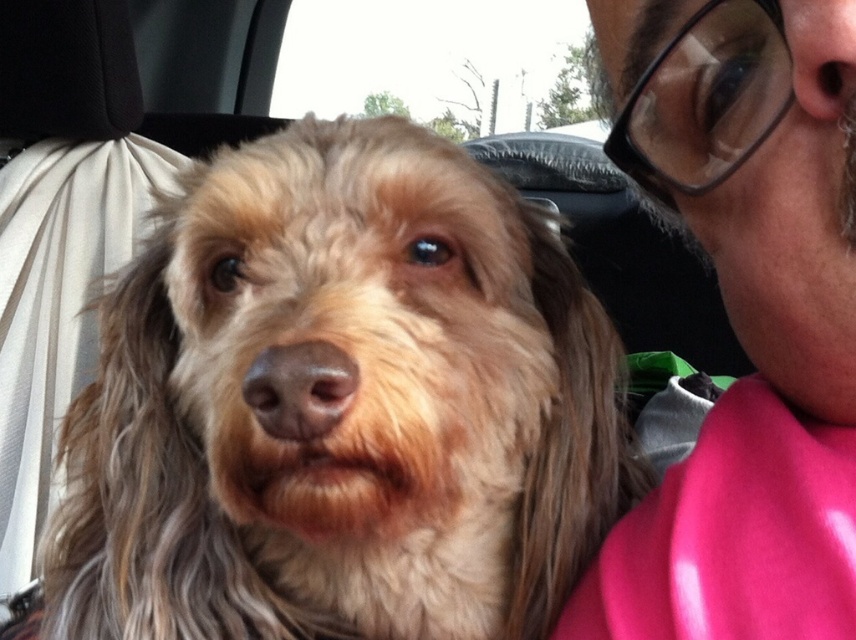
Question: Which of these objects is positioned farthest from the fuzzy brown dog at center?

Choices:
 (A) transparent glass car window at upper center
 (B) matte black glasses at upper left

Answer: (A)

Question: Is matte black glasses at upper left thinner than transparent glass car window at upper center?

Choices:
 (A) yes
 (B) no

Answer: (A)

Question: Can you confirm if fuzzy brown dog at center is positioned to the right of matte black glasses at upper left?

Choices:
 (A) yes
 (B) no

Answer: (B)

Question: Does fuzzy brown dog at center have a larger size compared to matte black glasses at upper left?

Choices:
 (A) yes
 (B) no

Answer: (A)

Question: Which object is the closest to the matte black glasses at upper left?

Choices:
 (A) transparent glass car window at upper center
 (B) fuzzy brown dog at center

Answer: (B)

Question: Which point is farther from the camera taking this photo?

Choices:
 (A) (140, 388)
 (B) (837, 572)

Answer: (A)